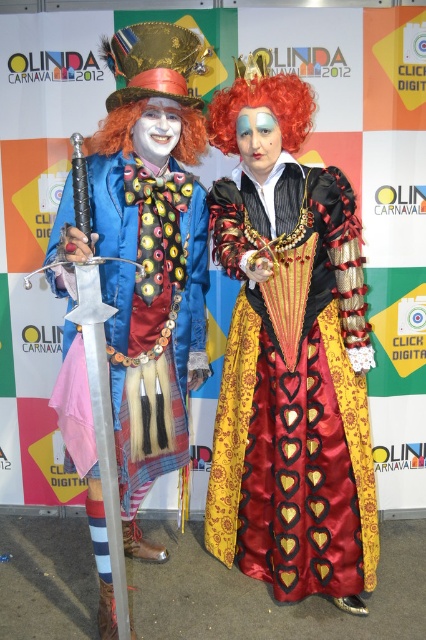
You are a photographer at the Olinda Carnaval 2012 event. You need to capture a closeup shot of the silver metallic sword at center and the matte red wig at center. Which object should you focus on first if you want to ensure both are in focus without moving the camera?

The silver metallic sword at center is positioned on the left side of matte red wig at center. Since both objects are at the same central area, adjusting the focus to the midpoint between them should keep both in focus without moving the camera.

You are standing in front of the Olinda Carnaval 2012 banner and see two points marked in the image. The first point is at coordinates point (101, 588) and the second is at point (270, 129). Which point is closer to you?

Point (101, 588) is closer to you because it is further to the camera than point (270, 129).